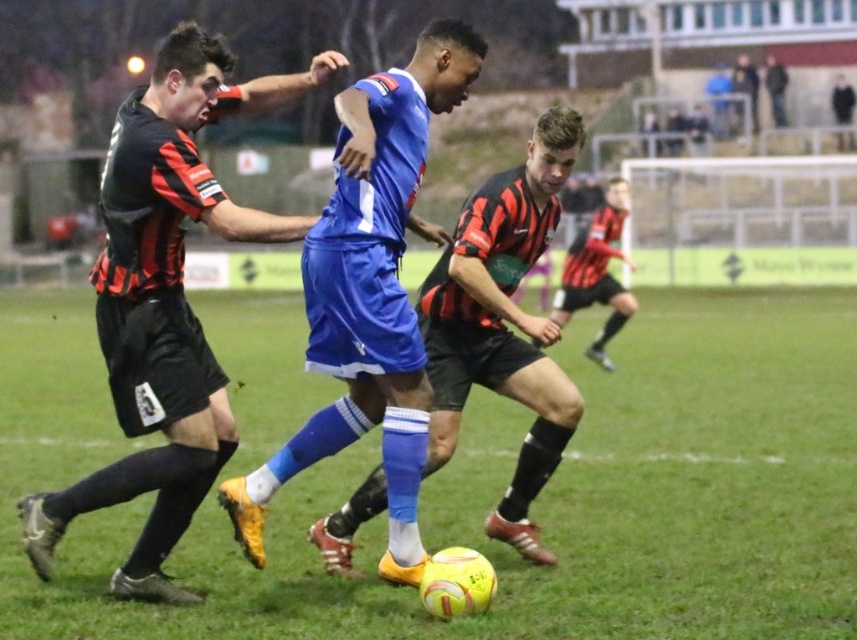
In the scene shown: Is black matte jersey at left above blue matte shorts at center?

Yes.

Which is above, black matte jersey at left or blue matte shorts at center?

black matte jersey at left is higher up.

Is point (166, 211) positioned before point (538, 211)?

Yes, it is in front of point (538, 211).

I want to click on black matte jersey at left, so tap(165, 301).

Can you confirm if black matte jersey at left is positioned to the left of blue matte soccer ball at center?

Yes, black matte jersey at left is to the left of blue matte soccer ball at center.

Between black matte jersey at left and blue matte soccer ball at center, which one appears on the right side from the viewer's perspective?

Positioned to the right is blue matte soccer ball at center.

Is point (106, 481) positioned before point (411, 516)?

No, it is behind (411, 516).

Locate an element on the screen. black matte jersey at left is located at coordinates (165, 301).

Which is more to the right, yellow matte soccer ball at center or black matte jersey at left?

yellow matte soccer ball at center

Is point (304, 609) farther from camera compared to point (196, 348)?

No, it is not.

Identify the location of yellow matte soccer ball at center. (496, 490).